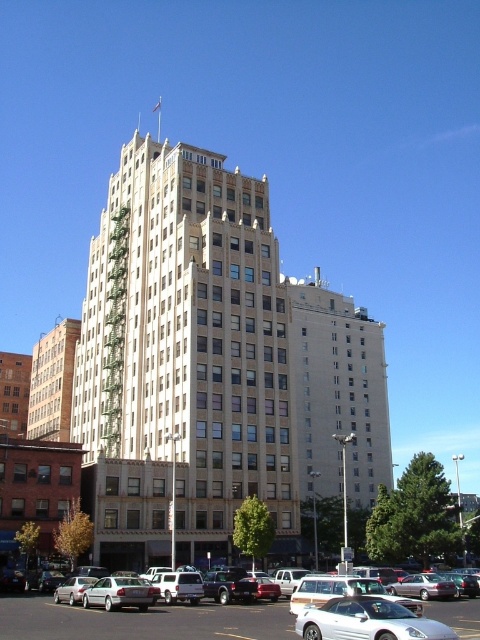
Question: Is white smooth building at center positioned in front of silver metallic car at center?

Choices:
 (A) yes
 (B) no

Answer: (B)

Question: Is white smooth building at center thinner than silver metallic car at center?

Choices:
 (A) yes
 (B) no

Answer: (B)

Question: Which is farther from the silver metallic car at center?

Choices:
 (A) white smooth building at center
 (B) silver metallic sedan at lower center

Answer: (A)

Question: Is silver metallic sedan at lower center to the right of silver metallic car at center from the viewer's perspective?

Choices:
 (A) yes
 (B) no

Answer: (B)

Question: Which of the following is the farthest from the observer?

Choices:
 (A) silver metallic sedan at lower center
 (B) white smooth building at center
 (C) silver metallic car at center

Answer: (B)

Question: Which of the following is the farthest from the observer?

Choices:
 (A) white smooth building at center
 (B) silver metallic sedan at lower center

Answer: (A)